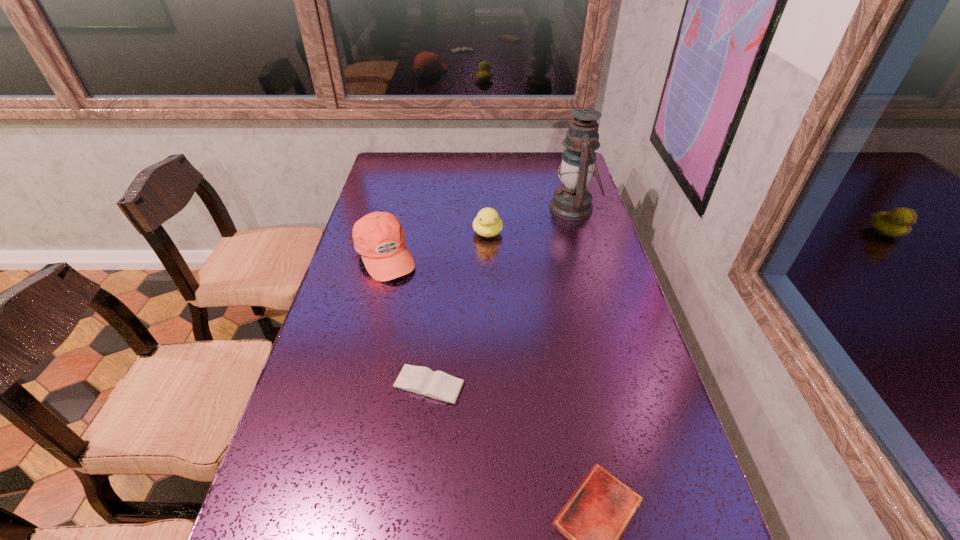
You are a GUI agent. You are given a task and a screenshot of the screen. Output one action in this format:
    pyautogui.click(x=<x>, y=<y>)
    Task: Click on the free space between the baseball cap and the left diary
    This screenshot has width=960, height=540.
    Given the screenshot: What is the action you would take?
    pyautogui.click(x=406, y=321)

Identify which object is the closest to the baseball cap. Please provide its 2D coordinates. Your answer should be formatted as a tuple, i.e. [(x, y)], where the tuple contains the x and y coordinates of a point satisfying the conditions above.

[(487, 223)]

Choose which object is the second nearest neighbor to the nearer diary. Please provide its 2D coordinates. Your answer should be formatted as a tuple, i.e. [(x, y)], where the tuple contains the x and y coordinates of a point satisfying the conditions above.

[(379, 238)]